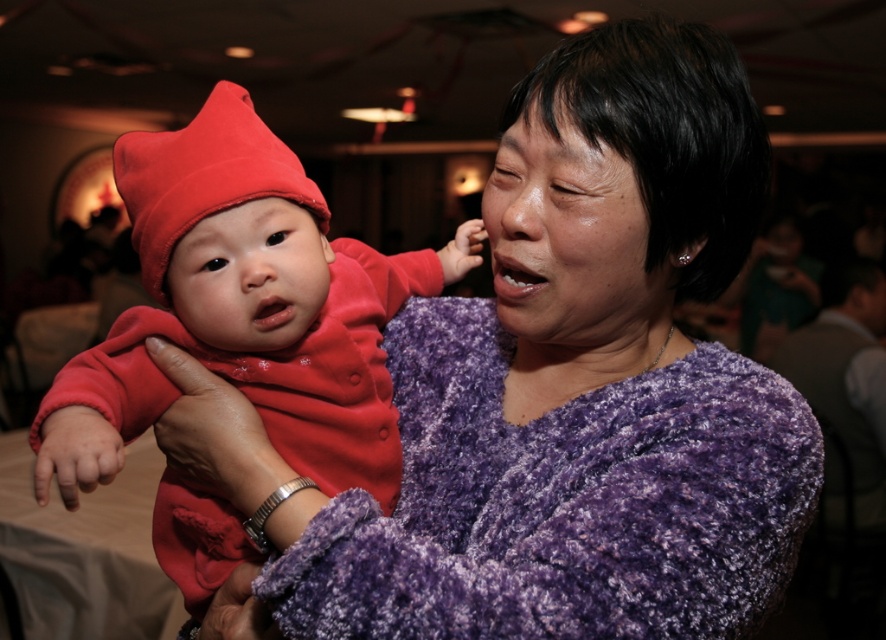
Who is positioned more to the right, purple fuzzy sweater at center or matte red beanie at center?

purple fuzzy sweater at center

Between purple fuzzy sweater at center and matte red beanie at center, which one has more height?

purple fuzzy sweater at center is taller.

What are the coordinates of `purple fuzzy sweater at center` in the screenshot? It's located at (579, 385).

You are a GUI agent. You are given a task and a screenshot of the screen. Output one action in this format:
    pyautogui.click(x=<x>, y=<y>)
    Task: Click on the velvety red baby at center
    
    Given the screenshot: What is the action you would take?
    pyautogui.click(x=245, y=308)

Which is above, velvety red baby at center or matte red beanie at center?

Positioned higher is matte red beanie at center.

Identify the location of velvety red baby at center. The width and height of the screenshot is (886, 640). (245, 308).

Identify the location of velvety red baby at center. (245, 308).

Can you confirm if purple fuzzy dress at center is positioned to the right of velvety red baby at center?

Correct, you'll find purple fuzzy dress at center to the right of velvety red baby at center.

Can you confirm if purple fuzzy dress at center is positioned to the left of velvety red baby at center?

Incorrect, purple fuzzy dress at center is not on the left side of velvety red baby at center.

Find the location of `purple fuzzy dress at center`. purple fuzzy dress at center is located at coordinates (560, 500).

This screenshot has width=886, height=640. In order to click on purple fuzzy dress at center in this screenshot , I will do `click(560, 500)`.